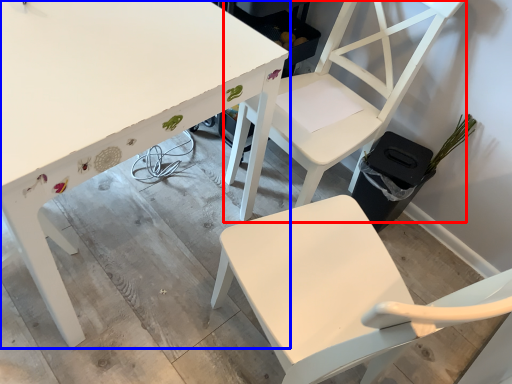
Question: Which object appears closest to the camera in this image, chair (highlighted by a red box) or table (highlighted by a blue box)?

Choices:
 (A) chair
 (B) table

Answer: (B)